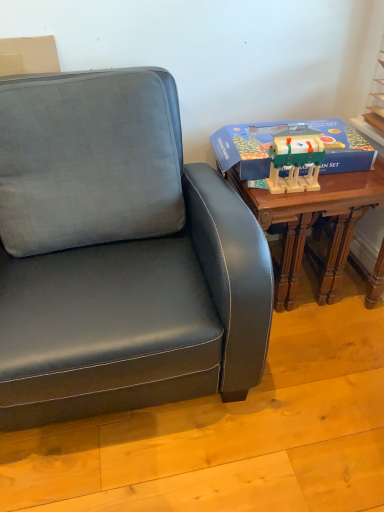
Where is `vacant space that's between blue cardboard box at right and wooden christmas train set at right`? vacant space that's between blue cardboard box at right and wooden christmas train set at right is located at coordinates (319, 182).